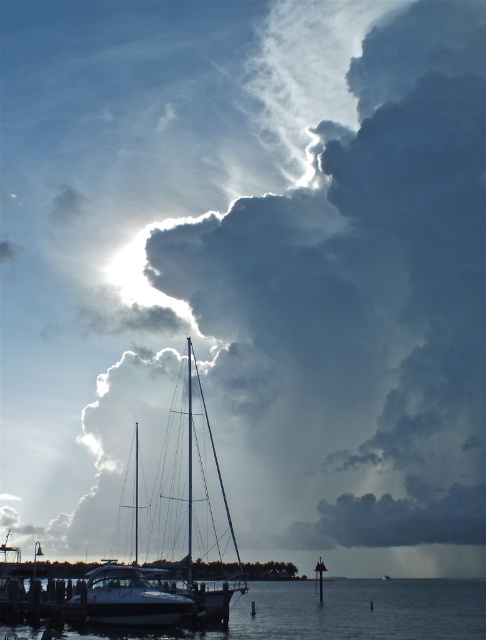
Question: Which point is closer to the camera taking this photo?

Choices:
 (A) (116, 616)
 (B) (331, 637)

Answer: (A)

Question: Among these points, which one is farthest from the camera?

Choices:
 (A) (378, 611)
 (B) (145, 624)

Answer: (A)

Question: Can you confirm if transparent water at lower center is positioned above white glossy boat at lower center?

Choices:
 (A) yes
 (B) no

Answer: (B)

Question: Is transparent water at lower center positioned in front of white glossy boat at lower center?

Choices:
 (A) no
 (B) yes

Answer: (A)

Question: Can you confirm if transparent water at lower center is wider than white glossy boat at lower center?

Choices:
 (A) yes
 (B) no

Answer: (A)

Question: Which of the following is the closest to the observer?

Choices:
 (A) (450, 632)
 (B) (142, 584)

Answer: (B)